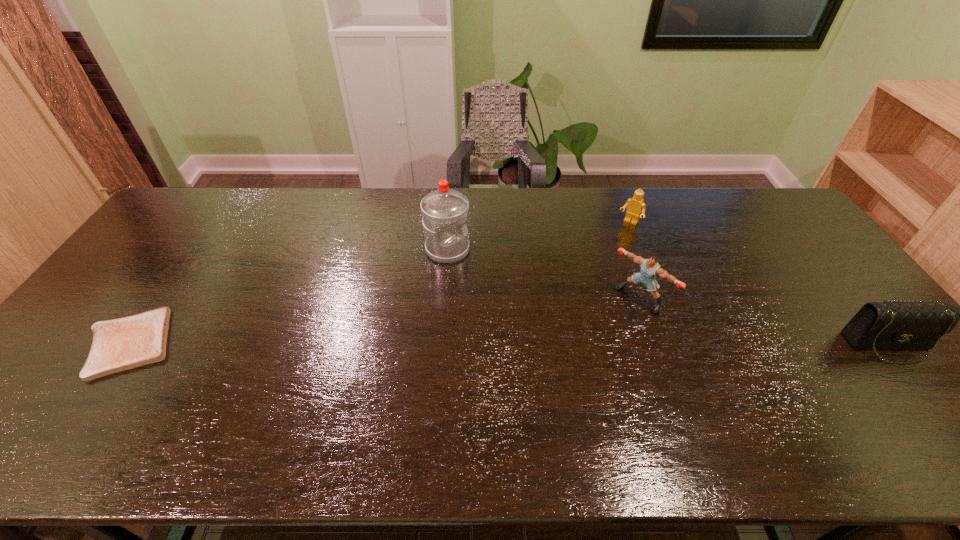
I want to click on vacant space located 0.060m on the front-facing side of the fourth shortest object, so tap(612, 323).

The height and width of the screenshot is (540, 960). In order to click on blank space located on the front-facing side of the fourth shortest object in this screenshot , I will do `click(541, 388)`.

Locate an element on the screen. vacant area located 0.260m on the face of the Lego is located at coordinates (592, 272).

I want to click on vacant space located on the face of the Lego, so click(x=574, y=295).

Locate an element on the screen. Image resolution: width=960 pixels, height=540 pixels. free spot located 0.120m on the face of the Lego is located at coordinates click(611, 247).

Locate an element on the screen. The width and height of the screenshot is (960, 540). free location located on the handle side of the water bottle is located at coordinates (476, 267).

Locate an element on the screen. This screenshot has height=540, width=960. free location located 0.110m on the handle side of the water bottle is located at coordinates (492, 275).

The image size is (960, 540). Find the location of `free space located 0.100m on the handle side of the water bottle`. free space located 0.100m on the handle side of the water bottle is located at coordinates (489, 274).

The height and width of the screenshot is (540, 960). In order to click on object that is at the far edge in this screenshot , I will do `click(635, 205)`.

Identify the location of object that is at the near edge. The image size is (960, 540). (120, 344).